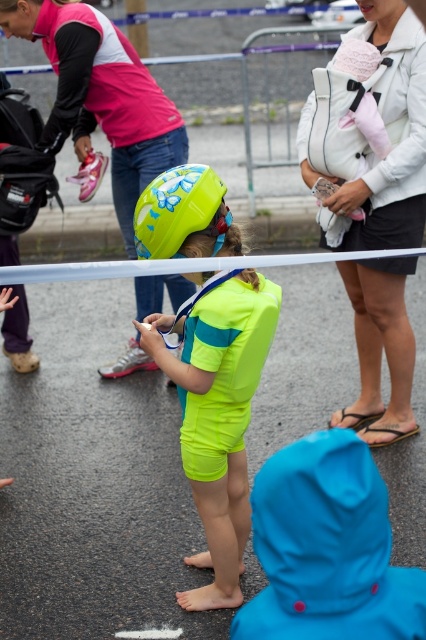
Image resolution: width=426 pixels, height=640 pixels. What do you see at coordinates (216, 410) in the screenshot? I see `neon yellow swimsuit at center` at bounding box center [216, 410].

Is the position of neon yellow swimsuit at center less distant than that of pink fabric jacket at upper left?

Yes, it is.

Between point (163, 364) and point (132, 83), which one is positioned in front?

Positioned in front is point (163, 364).

Locate an element on the screen. neon yellow swimsuit at center is located at coordinates (216, 410).

Is neon yellow swimsuit at center further to camera compared to light gray fabric baby carrier at upper right?

That is False.

Is neon yellow swimsuit at center wider than light gray fabric baby carrier at upper right?

Incorrect, neon yellow swimsuit at center's width does not surpass light gray fabric baby carrier at upper right's.

The height and width of the screenshot is (640, 426). Describe the element at coordinates (216, 410) in the screenshot. I see `neon yellow swimsuit at center` at that location.

Identify the location of neon yellow swimsuit at center. (216, 410).

Identify the location of light gray fabric baby carrier at upper right. 397,145.

Who is positioned more to the right, light gray fabric baby carrier at upper right or pink fabric jacket at upper left?

light gray fabric baby carrier at upper right is more to the right.

Identify the location of light gray fabric baby carrier at upper right. The height and width of the screenshot is (640, 426). (397, 145).

Find the location of a particular element. The height and width of the screenshot is (640, 426). light gray fabric baby carrier at upper right is located at coordinates (397, 145).